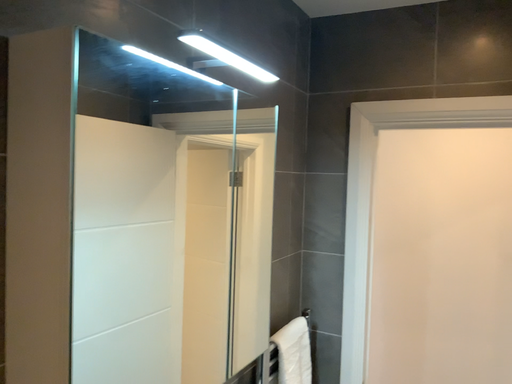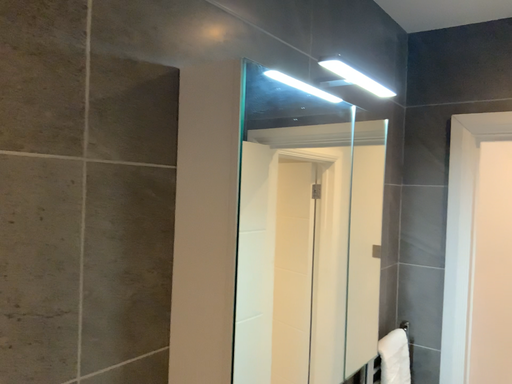
Question: Which way did the camera rotate in the video?

Choices:
 (A) rotated left
 (B) rotated right

Answer: (A)